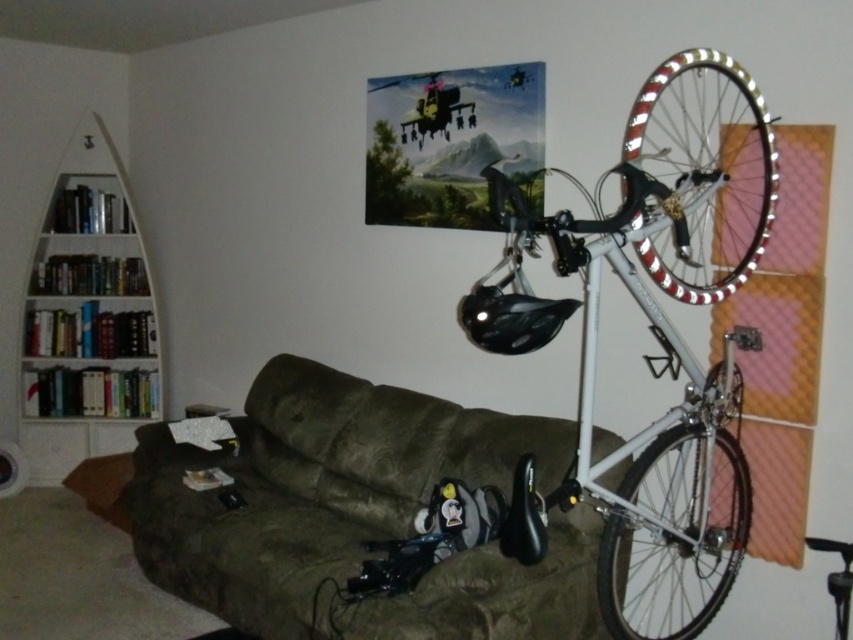
Question: Where is white metallic bicycle at upper right located in relation to white wooden bookshelf at left in the image?

Choices:
 (A) below
 (B) above

Answer: (A)

Question: Which point appears closest to the camera in this image?

Choices:
 (A) (691, 524)
 (B) (88, 385)
 (C) (654, 225)

Answer: (C)

Question: Does white metallic bicycle at upper right come in front of white metallic bicycle wheel at right?

Choices:
 (A) yes
 (B) no

Answer: (A)

Question: Based on their relative distances, which object is nearer to the white metallic wheel at upper right?

Choices:
 (A) white metallic bicycle wheel at right
 (B) white metallic bicycle at upper right

Answer: (B)

Question: Can you confirm if brown suede couch at lower center is smaller than white metallic bicycle wheel at right?

Choices:
 (A) yes
 (B) no

Answer: (B)

Question: Among these objects, which one is nearest to the camera?

Choices:
 (A) white metallic bicycle at upper right
 (B) brown suede couch at lower center
 (C) white metallic bicycle wheel at right
 (D) white metallic wheel at upper right

Answer: (A)